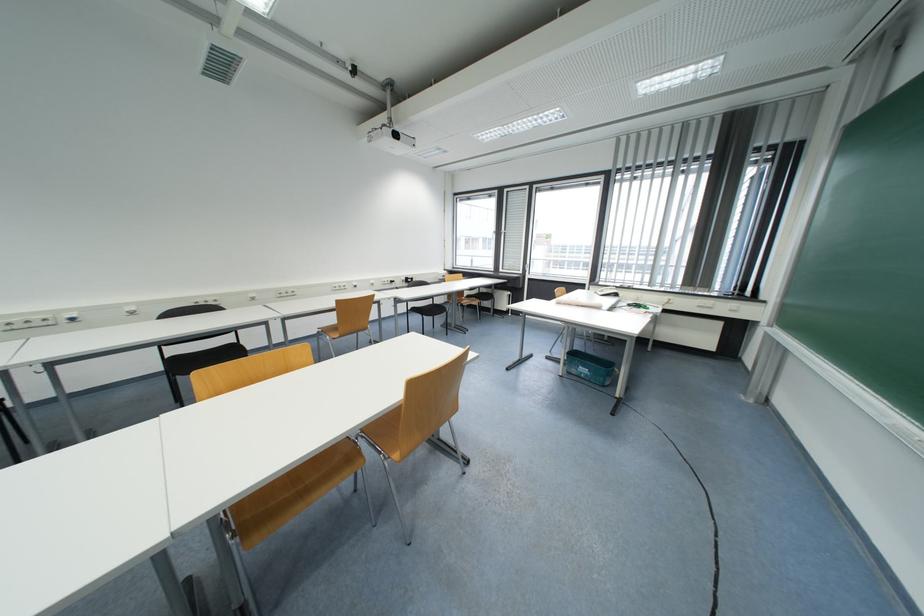
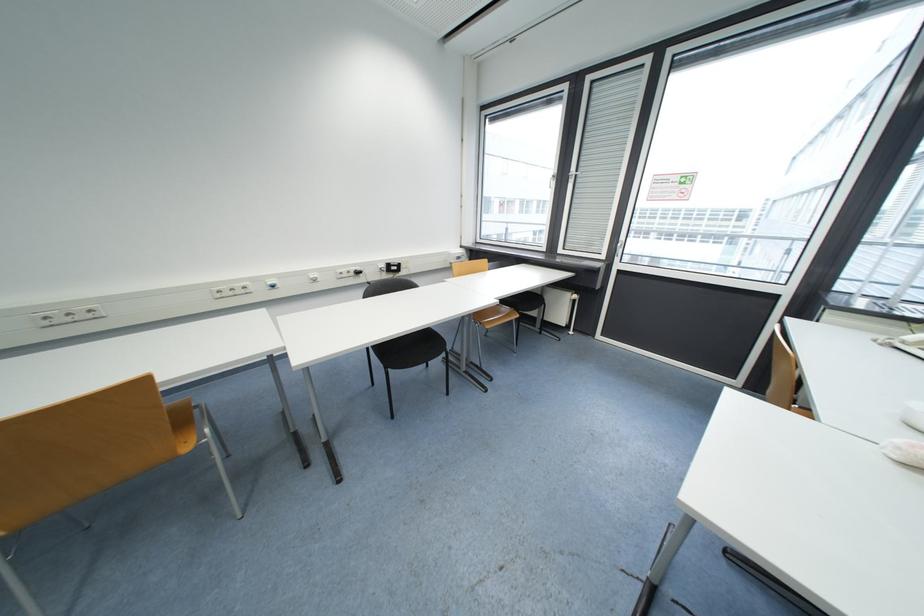
Where in the second image is the point corresponding to (511,192) from the first image?

(593, 81)